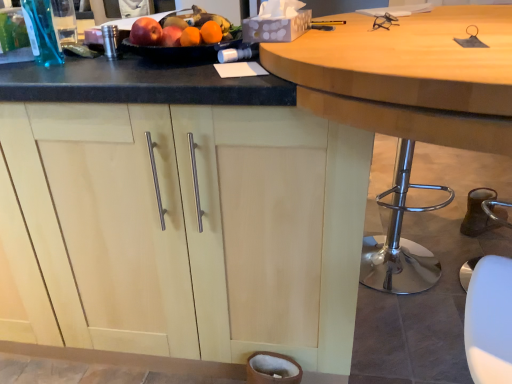
Question: From a real-world perspective, is glossy plastic fruit dish at upper center under wooden table at center?

Choices:
 (A) no
 (B) yes

Answer: (A)

Question: Is glossy plastic fruit dish at upper center next to wooden table at center?

Choices:
 (A) no
 (B) yes

Answer: (A)

Question: Is glossy plastic fruit dish at upper center oriented away from wooden table at center?

Choices:
 (A) no
 (B) yes

Answer: (B)

Question: Considering the relative sizes of glossy plastic fruit dish at upper center and wooden table at center in the image provided, is glossy plastic fruit dish at upper center wider than wooden table at center?

Choices:
 (A) no
 (B) yes

Answer: (A)

Question: From a real-world perspective, is glossy plastic fruit dish at upper center on top of wooden table at center?

Choices:
 (A) no
 (B) yes

Answer: (B)

Question: Choose the correct answer: Is wooden table at center inside light wood cabinet at center or outside it?

Choices:
 (A) outside
 (B) inside

Answer: (A)

Question: From the image's perspective, is wooden table at center positioned above or below light wood cabinet at center?

Choices:
 (A) below
 (B) above

Answer: (A)

Question: Considering their positions, is wooden table at center located in front of or behind light wood cabinet at center?

Choices:
 (A) behind
 (B) front

Answer: (B)

Question: In terms of height, does wooden table at center look taller or shorter compared to light wood cabinet at center?

Choices:
 (A) tall
 (B) short

Answer: (A)

Question: From the image's perspective, is light wood cabinet at center above or below glossy plastic fruit dish at upper center?

Choices:
 (A) below
 (B) above

Answer: (A)

Question: Does point (208, 162) appear closer or farther from the camera than point (193, 11)?

Choices:
 (A) farther
 (B) closer

Answer: (B)

Question: Is light wood cabinet at center bigger or smaller than glossy plastic fruit dish at upper center?

Choices:
 (A) small
 (B) big

Answer: (B)

Question: From a real-world perspective, is light wood cabinet at center positioned above or below glossy plastic fruit dish at upper center?

Choices:
 (A) below
 (B) above

Answer: (A)

Question: From a real-world perspective, is glossy plastic fruit dish at upper center physically located above or below light wood cabinet at center?

Choices:
 (A) above
 (B) below

Answer: (A)

Question: Relative to light wood cabinet at center, is glossy plastic fruit dish at upper center in front or behind?

Choices:
 (A) behind
 (B) front

Answer: (A)